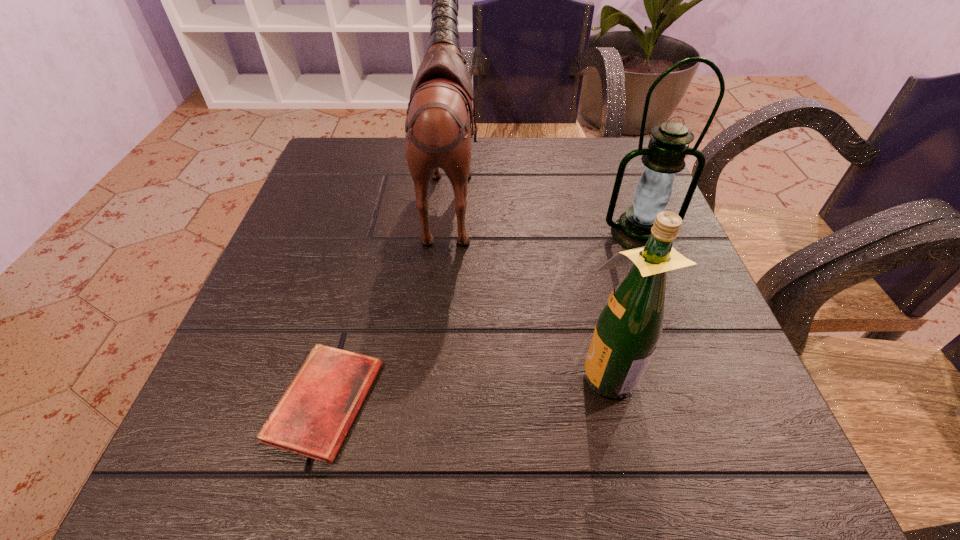
You are a GUI agent. You are given a task and a screenshot of the screen. Output one action in this format:
    pyautogui.click(x=<x>, y=<y>)
    Task: Click on the free space at the far left corner of the desktop
    
    Given the screenshot: What is the action you would take?
    pyautogui.click(x=346, y=145)

In the image, there is a desktop. Where is `free space at the near left corner`? This screenshot has width=960, height=540. free space at the near left corner is located at coordinates (229, 464).

Where is `vacant region between the second object from left to right and the rightmost object`? The height and width of the screenshot is (540, 960). vacant region between the second object from left to right and the rightmost object is located at coordinates (544, 212).

Find the location of a particular element. Image resolution: width=960 pixels, height=540 pixels. free space between the third object from left to right and the leftmost object is located at coordinates (466, 387).

Identify the location of free spot between the lantern and the diary. (482, 318).

You are a GUI agent. You are given a task and a screenshot of the screen. Output one action in this format:
    pyautogui.click(x=<x>, y=<y>)
    Task: Click on the vacant space in between the liquor and the second object from left to right
    The image size is (960, 540).
    Given the screenshot: What is the action you would take?
    pyautogui.click(x=528, y=281)

Image resolution: width=960 pixels, height=540 pixels. In order to click on free spot between the shortest object and the second object from right to left in this screenshot , I will do `click(466, 387)`.

Where is `vacant space that's between the liquor and the third object from right to left`? vacant space that's between the liquor and the third object from right to left is located at coordinates (528, 281).

Image resolution: width=960 pixels, height=540 pixels. In order to click on free point between the second object from left to right and the rightmost object in this screenshot , I will do `click(544, 212)`.

Select which object appears as the second closest to the shortest object. Please provide its 2D coordinates. Your answer should be formatted as a tuple, i.e. [(x, y)], where the tuple contains the x and y coordinates of a point satisfying the conditions above.

[(630, 324)]